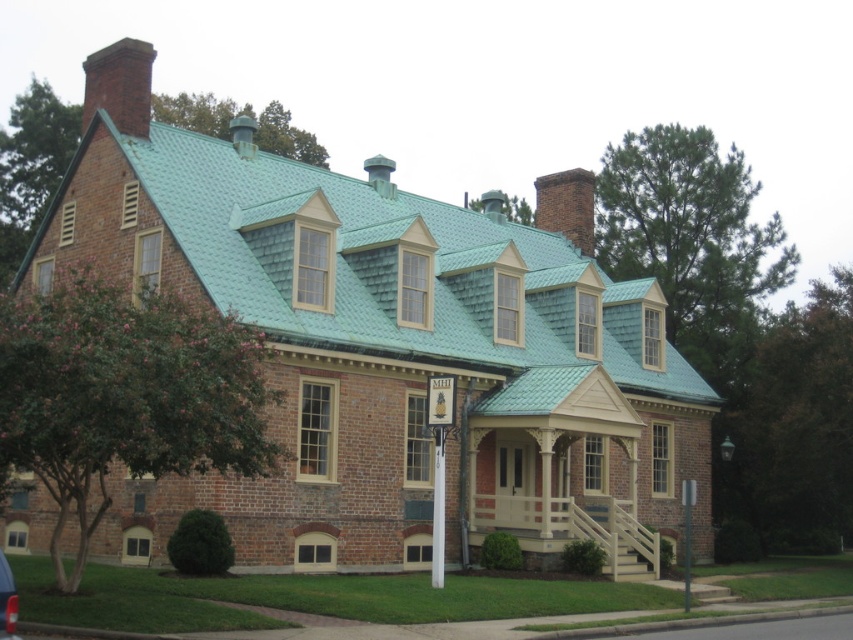
Question: Is beige painted wood porch at center positioned at the back of brick chimney at upper left?

Choices:
 (A) no
 (B) yes

Answer: (A)

Question: Is white plastic pole at center above metallic silver pole at lower right?

Choices:
 (A) yes
 (B) no

Answer: (A)

Question: Among these objects, which one is nearest to the camera?

Choices:
 (A) beige painted wood porch at center
 (B) teal shingles at center

Answer: (B)

Question: Is beige painted wood porch at center to the left of metallic silver pole at lower right from the viewer's perspective?

Choices:
 (A) no
 (B) yes

Answer: (B)

Question: Which object is positioned closest to the brick chimney at upper left?

Choices:
 (A) metallic silver pole at lower right
 (B) beige painted wood porch at center
 (C) teal shingles at center

Answer: (C)

Question: Which is farther from the brick chimney at upper left?

Choices:
 (A) teal shingles at center
 (B) white plastic pole at center
 (C) beige painted wood porch at center

Answer: (C)